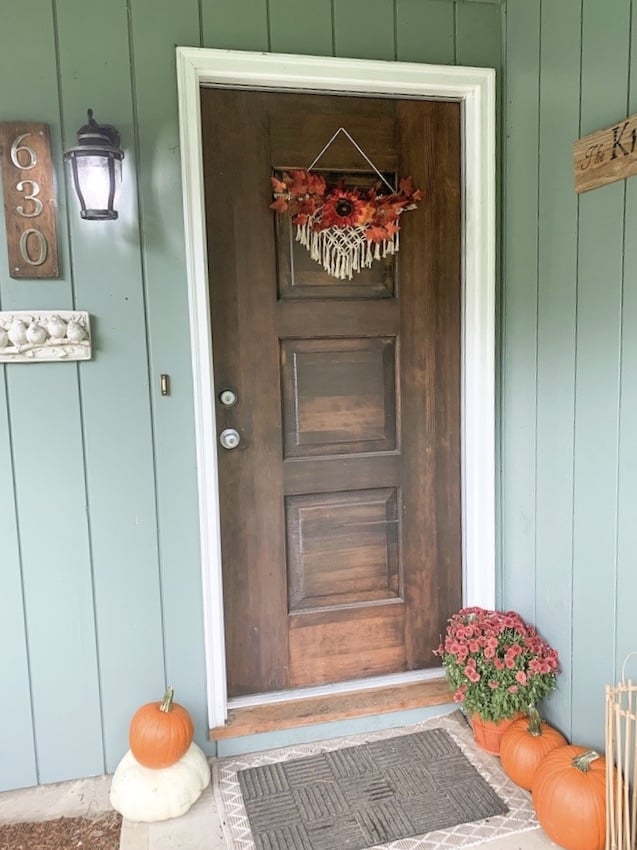
You are a GUI agent. You are given a task and a screenshot of the screen. Output one action in this format:
    pyautogui.click(x=<x>, y=<y>)
    Task: Click on the top section of doorframe
    This screenshot has width=637, height=850.
    Given the screenshot: What is the action you would take?
    pyautogui.click(x=334, y=69)